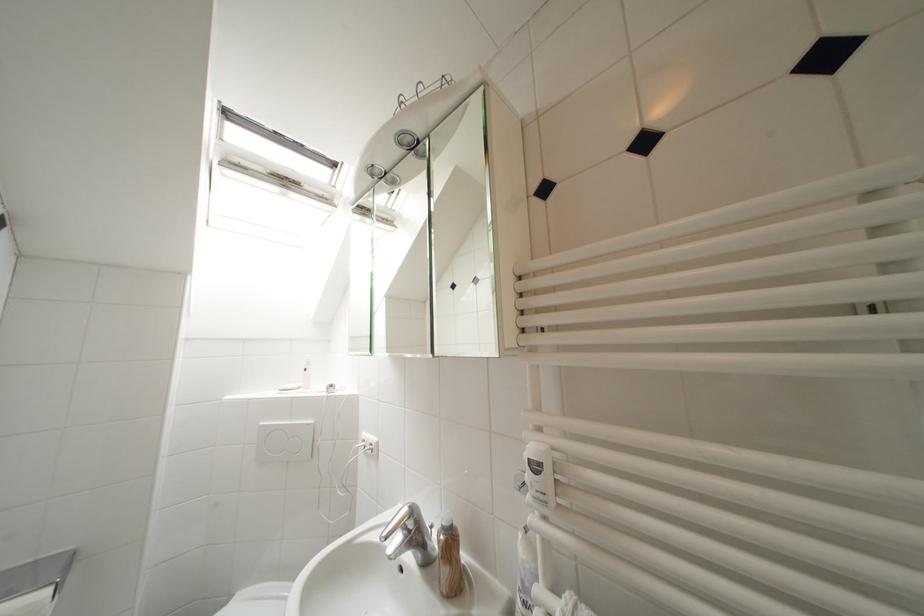
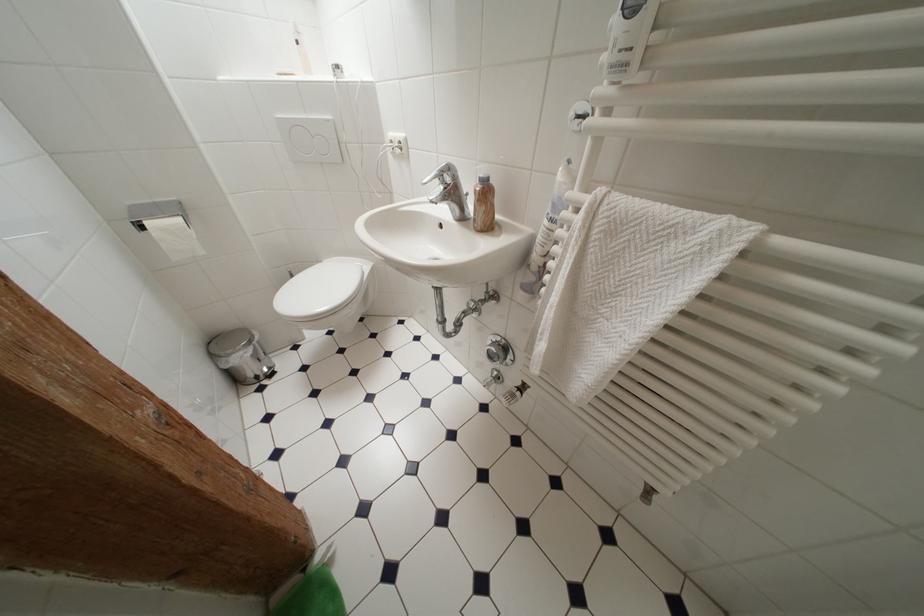
In the second image, find the point that corresponds to point 419,515 in the first image.

(456, 171)